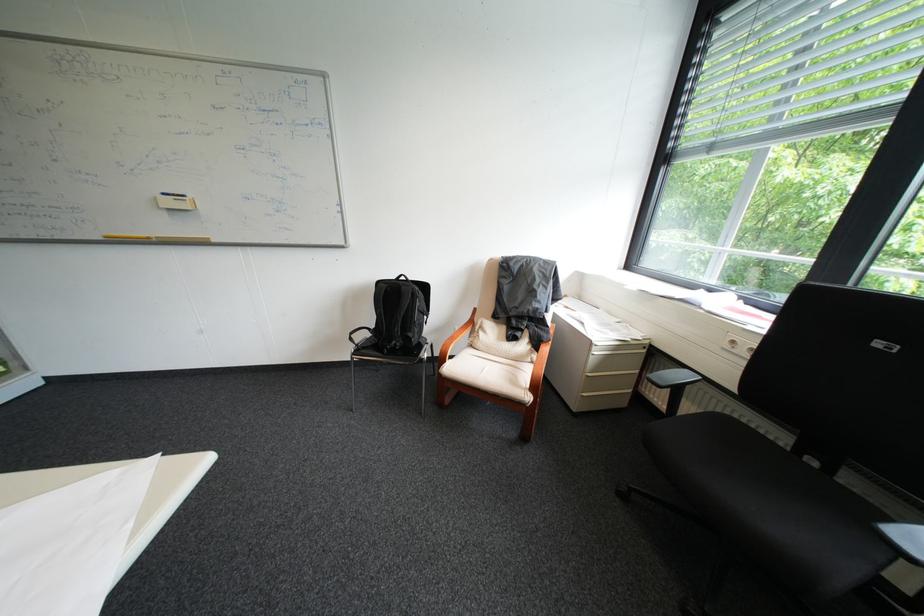
The width and height of the screenshot is (924, 616). Describe the element at coordinates (740, 346) in the screenshot. I see `a white power socket` at that location.